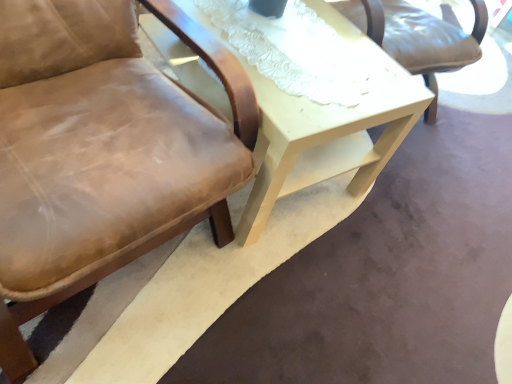
What are the coordinates of `free location to the right of brown leather chair at left` in the screenshot? It's located at (290, 293).